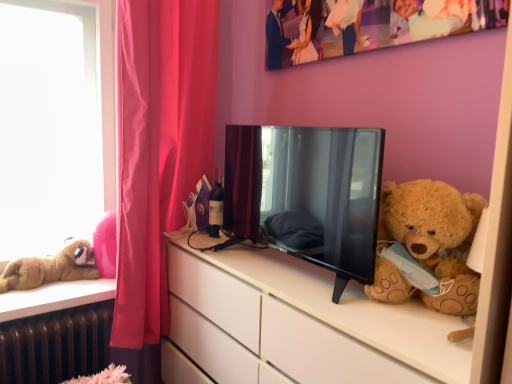
Question: Can you confirm if brown metallic radiator at lower left is wider than matte glass bottle at center?

Choices:
 (A) yes
 (B) no

Answer: (A)

Question: Considering the relative sizes of brown metallic radiator at lower left and matte glass bottle at center in the image provided, is brown metallic radiator at lower left shorter than matte glass bottle at center?

Choices:
 (A) yes
 (B) no

Answer: (B)

Question: Is brown metallic radiator at lower left facing away from matte glass bottle at center?

Choices:
 (A) yes
 (B) no

Answer: (B)

Question: Would you say brown metallic radiator at lower left contains matte glass bottle at center?

Choices:
 (A) no
 (B) yes

Answer: (A)

Question: From a real-world perspective, is brown metallic radiator at lower left positioned under matte glass bottle at center based on gravity?

Choices:
 (A) yes
 (B) no

Answer: (A)

Question: In terms of height, does pink rubber ball at left look taller or shorter compared to fluffy brown teddy bear at right, the 2th teddy bear when ordered from left to right?

Choices:
 (A) short
 (B) tall

Answer: (A)

Question: Which is correct: pink rubber ball at left is inside fluffy brown teddy bear at right, the 2th teddy bear when ordered from left to right, or outside of it?

Choices:
 (A) outside
 (B) inside

Answer: (A)

Question: Considering their positions, is pink rubber ball at left located in front of or behind fluffy brown teddy bear at right, acting as the first teddy bear starting from the front?

Choices:
 (A) behind
 (B) front

Answer: (A)

Question: Is point (101, 233) closer or farther from the camera than point (444, 221)?

Choices:
 (A) farther
 (B) closer

Answer: (A)

Question: From their relative heights in the image, would you say matte glass bottle at center is taller or shorter than pink rubber ball at left?

Choices:
 (A) short
 (B) tall

Answer: (B)

Question: Is matte glass bottle at center inside the boundaries of pink rubber ball at left, or outside?

Choices:
 (A) inside
 (B) outside

Answer: (B)

Question: From a real-world perspective, relative to pink rubber ball at left, is matte glass bottle at center vertically above or below?

Choices:
 (A) below
 (B) above

Answer: (B)

Question: Looking at the image, does matte glass bottle at center seem bigger or smaller compared to pink rubber ball at left?

Choices:
 (A) big
 (B) small

Answer: (B)

Question: Considering the positions of matte pink curtain at left and white matte cabinet at right in the image, is matte pink curtain at left taller or shorter than white matte cabinet at right?

Choices:
 (A) tall
 (B) short

Answer: (A)

Question: Is matte pink curtain at left wider or thinner than white matte cabinet at right?

Choices:
 (A) wide
 (B) thin

Answer: (B)